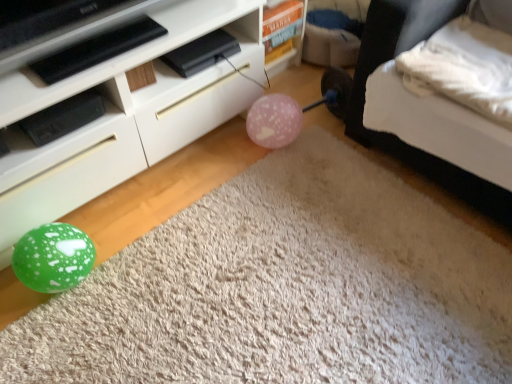
Where is `free location to the left of pink matte balloon at center`? The width and height of the screenshot is (512, 384). free location to the left of pink matte balloon at center is located at coordinates (227, 147).